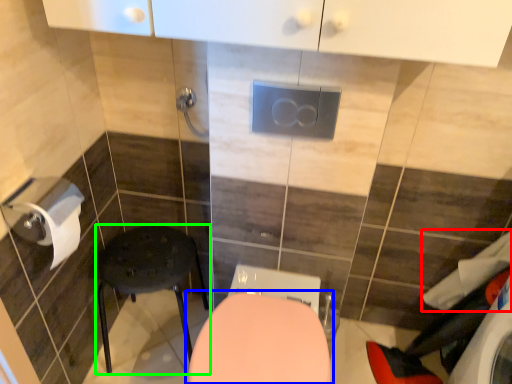
Question: Which object is positioned farthest from laundry (highlighted by a red box)? Select from toilet (highlighted by a blue box) and furniture (highlighted by a green box).

Choices:
 (A) toilet
 (B) furniture

Answer: (B)